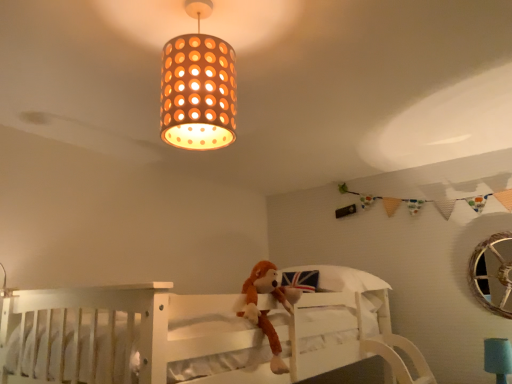
Question: In terms of width, does orange perforated paper lampshade at upper center look wider or thinner when compared to brown plush monkey at center?

Choices:
 (A) wide
 (B) thin

Answer: (A)

Question: Does point (233, 77) appear closer or farther from the camera than point (266, 269)?

Choices:
 (A) farther
 (B) closer

Answer: (B)

Question: Which of these objects is positioned farthest from the white wooden bunk bed at center?

Choices:
 (A) orange perforated paper lampshade at upper center
 (B) teal fabric lampshade at lower right
 (C) brown plush monkey at center

Answer: (B)

Question: Which is farther from the teal fabric lampshade at lower right?

Choices:
 (A) brown plush monkey at center
 (B) orange perforated paper lampshade at upper center
 (C) white wooden bunk bed at center

Answer: (B)